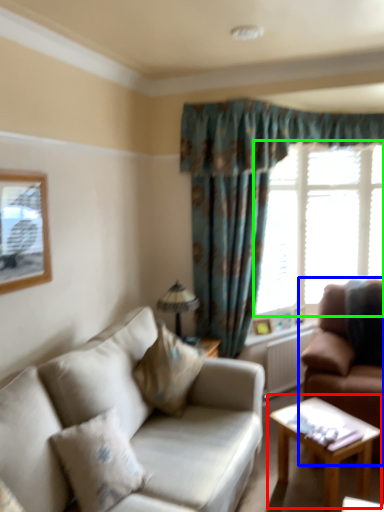
Question: Considering the real-world distances, which object is closest to coffee table (highlighted by a red box)? studio couch (highlighted by a blue box) or window (highlighted by a green box).

Choices:
 (A) studio couch
 (B) window

Answer: (A)